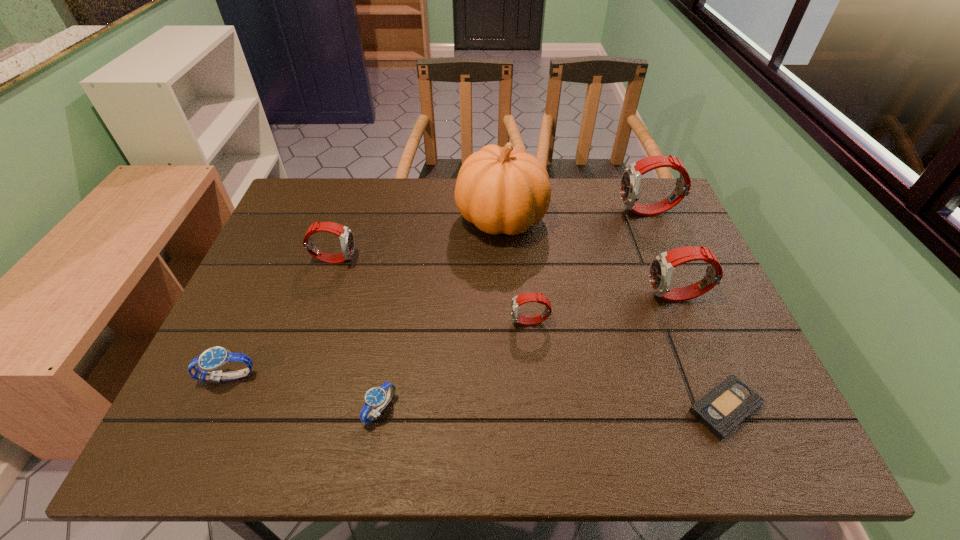
Find the location of `object that is the sixth closest to the pumpkin`. object that is the sixth closest to the pumpkin is located at coordinates (721, 410).

I want to click on watch that is the second closest to the second tallest object, so click(518, 300).

Identify which watch is the second closest to the third nearest watch. Please provide its 2D coordinates. Your answer should be formatted as a tuple, i.e. [(x, y)], where the tuple contains the x and y coordinates of a point satisfying the conditions above.

[(376, 397)]

The image size is (960, 540). I want to click on red watch that stands as the closest to the fourth farthest watch, so click(662, 266).

Locate which red watch is the closest to the tallest object. Please provide its 2D coordinates. Your answer should be formatted as a tuple, i.e. [(x, y)], where the tuple contains the x and y coordinates of a point satisfying the conditions above.

[(631, 178)]

At what (x,y) coordinates should I click in order to perform the action: click on free region that satisfies the following two spatial constraints: 1. on the face of the second tallest object; 2. on the front side of the videotape. Please return your answer as a coordinate pair (x, y). This screenshot has width=960, height=540. Looking at the image, I should click on (732, 408).

Locate an element on the screen. free spot that satisfies the following two spatial constraints: 1. on the back side of the sixth object from right to left; 2. on the face of the second smallest red watch is located at coordinates (406, 259).